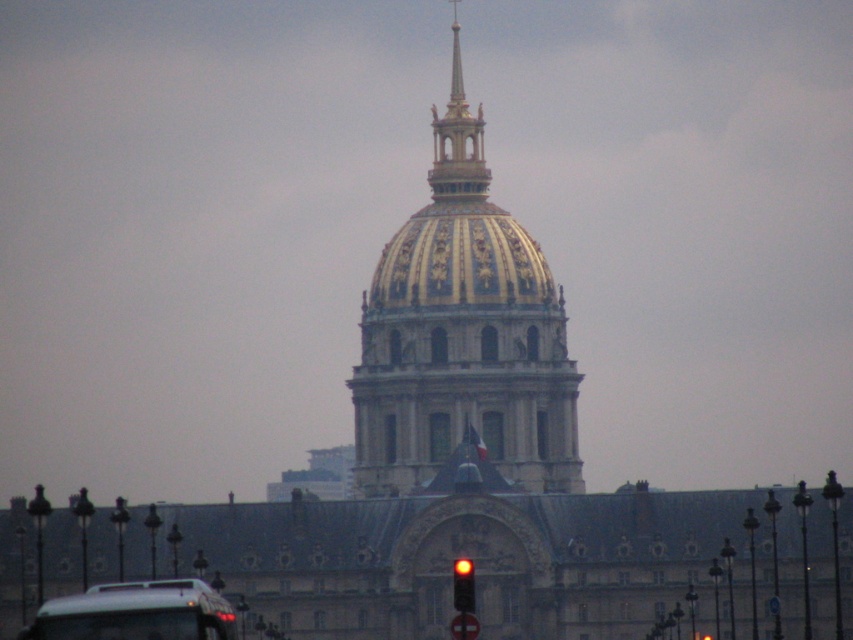
Question: Is gold/gilded dome at center above red glass traffic light at center?

Choices:
 (A) no
 (B) yes

Answer: (B)

Question: Does white matte bus at lower left have a greater width compared to red glass traffic light at center?

Choices:
 (A) yes
 (B) no

Answer: (A)

Question: Which of these objects is positioned closest to the white matte bus at lower left?

Choices:
 (A) gold/gilded dome at center
 (B) red glass traffic light at center

Answer: (B)

Question: Which point is closer to the camera?

Choices:
 (A) gold/gilded dome at center
 (B) red glass traffic light at center
 (C) white matte bus at lower left

Answer: (C)

Question: Among these objects, which one is farthest from the camera?

Choices:
 (A) gold/gilded dome at center
 (B) white matte bus at lower left
 (C) red glass traffic light at center

Answer: (A)

Question: Does gold/gilded dome at center have a smaller size compared to red glass traffic light at center?

Choices:
 (A) yes
 (B) no

Answer: (B)